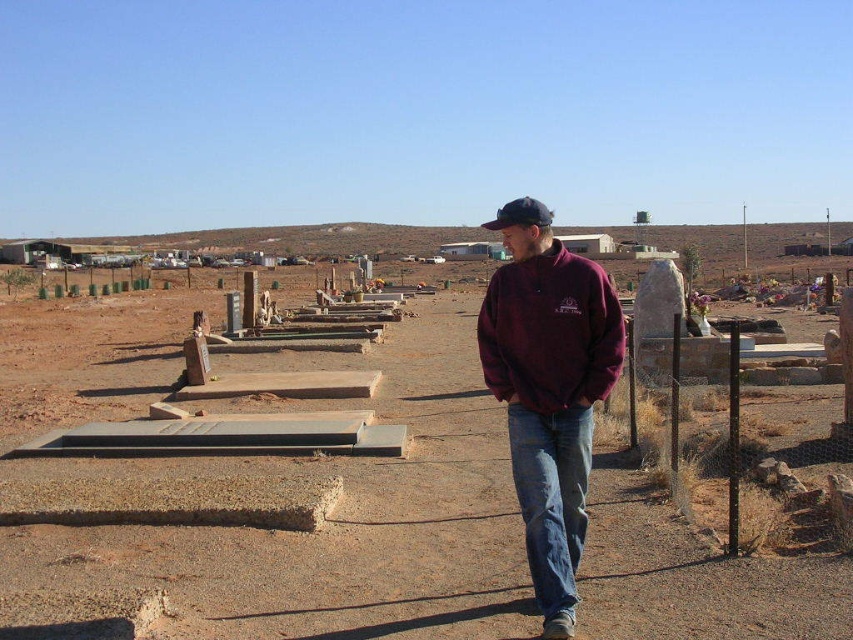
Question: Which of these objects is positioned farthest from the maroon fleece sweatshirt at center?

Choices:
 (A) maroon fleece jacket at center
 (B) brown dirt field at center

Answer: (B)

Question: Can you confirm if maroon fleece jacket at center is positioned to the left of maroon fleece sweatshirt at center?

Choices:
 (A) no
 (B) yes

Answer: (B)

Question: Estimate the real-world distances between objects in this image. Which object is farther from the maroon fleece sweatshirt at center?

Choices:
 (A) brown dirt field at center
 (B) maroon fleece jacket at center

Answer: (A)

Question: Does brown dirt field at center have a lesser width compared to maroon fleece jacket at center?

Choices:
 (A) no
 (B) yes

Answer: (A)

Question: Does maroon fleece jacket at center appear on the right side of maroon fleece sweatshirt at center?

Choices:
 (A) no
 (B) yes

Answer: (A)

Question: Among these points, which one is farthest from the camera?

Choices:
 (A) (541, 365)
 (B) (550, 406)

Answer: (A)